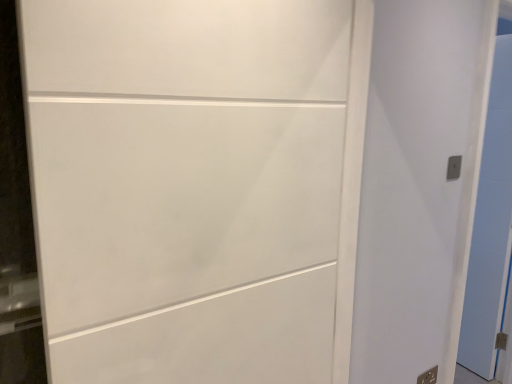
Question: In the image, is metallic silver outlet at lower right, which is counted as the 1th electric outlet, starting from the bottom, positioned in front of or behind white matte door at center, placed as the 3th door when sorted from back to front?

Choices:
 (A) front
 (B) behind

Answer: (B)

Question: From their relative heights in the image, would you say metallic silver outlet at lower right, arranged as the 2th electric outlet when viewed from the top, is taller or shorter than white matte door at center, the 3th door positioned from the right?

Choices:
 (A) tall
 (B) short

Answer: (B)

Question: Which of these objects is positioned farthest from the white glossy door at right, marked as the first door in a right-to-left arrangement?

Choices:
 (A) white matte door at right, acting as the 2th door starting from the right
 (B) white matte door at center, the 1th door viewed from the left
 (C) metallic silver electric outlet at upper right, the first electric outlet positioned from the front
 (D) metallic silver outlet at lower right, arranged as the 2th electric outlet when viewed from the top

Answer: (B)

Question: Which object is the closest to the metallic silver outlet at lower right, which appears as the second electric outlet when viewed from the front?

Choices:
 (A) metallic silver electric outlet at upper right, placed as the second electric outlet when sorted from bottom to top
 (B) white glossy door at right, which appears as the third door when viewed from the left
 (C) white matte door at right, acting as the 2th door starting from the right
 (D) white matte door at center, placed as the 3th door when sorted from back to front

Answer: (C)